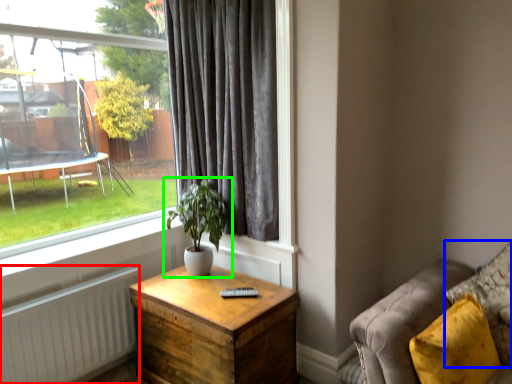
Question: Which object is the farthest from radiator (highlighted by a red box)? Choose among these: pillow (highlighted by a blue box) or houseplant (highlighted by a green box).

Choices:
 (A) pillow
 (B) houseplant

Answer: (A)